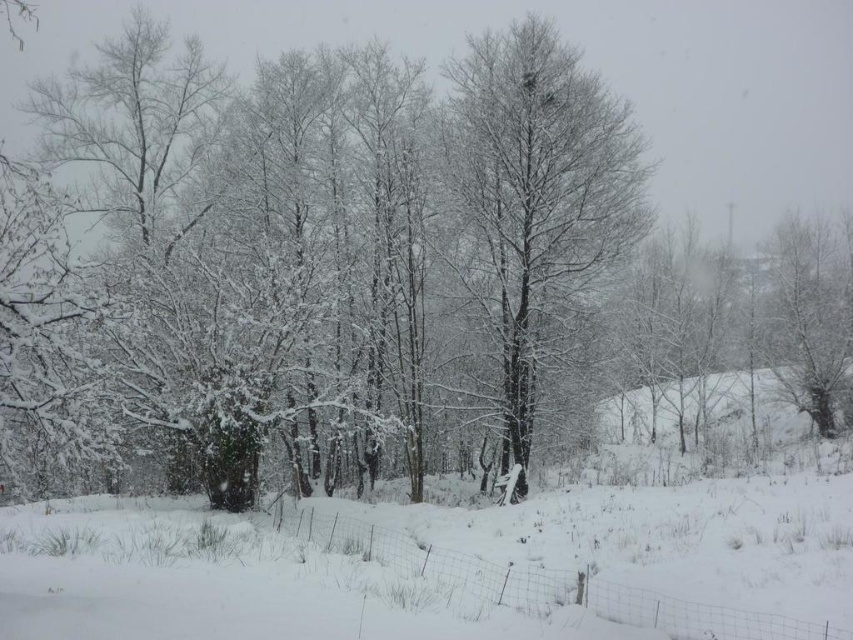
You are standing in the winter landscape and want to place a small snowman exactly halfway between the point at coordinates point (706, 490) and point (503, 104). Will the snowman be closer to the camera or farther away compared to the average distance of the two points?

The snowman placed halfway between point (706, 490) and point (503, 104) will be closer to the camera than the average distance because point (706, 490) is closer to the camera than point (503, 104).